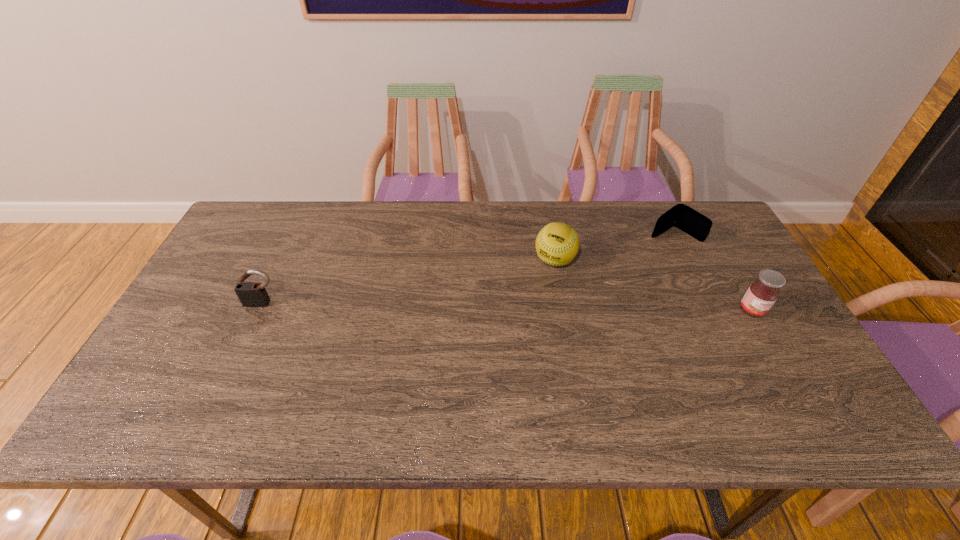
At what (x,y) coordinates should I click in order to perform the action: click on vacant space at the far edge of the desktop. Please return your answer as a coordinate pair (x, y). The height and width of the screenshot is (540, 960). Looking at the image, I should click on (564, 204).

The height and width of the screenshot is (540, 960). In order to click on free space at the near edge of the desktop in this screenshot , I will do `click(567, 378)`.

In the image, there is a desktop. Find the location of `free space at the left edge`. free space at the left edge is located at coordinates (251, 275).

Image resolution: width=960 pixels, height=540 pixels. I want to click on vacant space at the right edge, so pyautogui.click(x=739, y=264).

Locate an element on the screen. vacant space at the far left corner of the desktop is located at coordinates (275, 236).

Image resolution: width=960 pixels, height=540 pixels. What are the coordinates of `unoccupied area between the second object from left to right and the leftmost object` in the screenshot? It's located at (409, 282).

Where is `empty space that is in between the jam and the leftmost object`? This screenshot has width=960, height=540. empty space that is in between the jam and the leftmost object is located at coordinates (507, 307).

Where is `free space between the softball and the farthest object`? The width and height of the screenshot is (960, 540). free space between the softball and the farthest object is located at coordinates (614, 247).

The height and width of the screenshot is (540, 960). I want to click on vacant area between the softball and the jam, so click(x=654, y=285).

Identify the location of vacant area that lies between the leftmost object and the third nearest object. (409, 282).